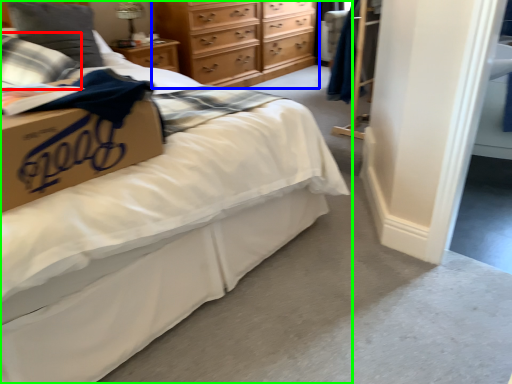
Question: Based on their relative distances, which object is nearer to pillow (highlighted by a red box)? Choose from chest of drawers (highlighted by a blue box) and bed (highlighted by a green box).

Choices:
 (A) chest of drawers
 (B) bed

Answer: (B)